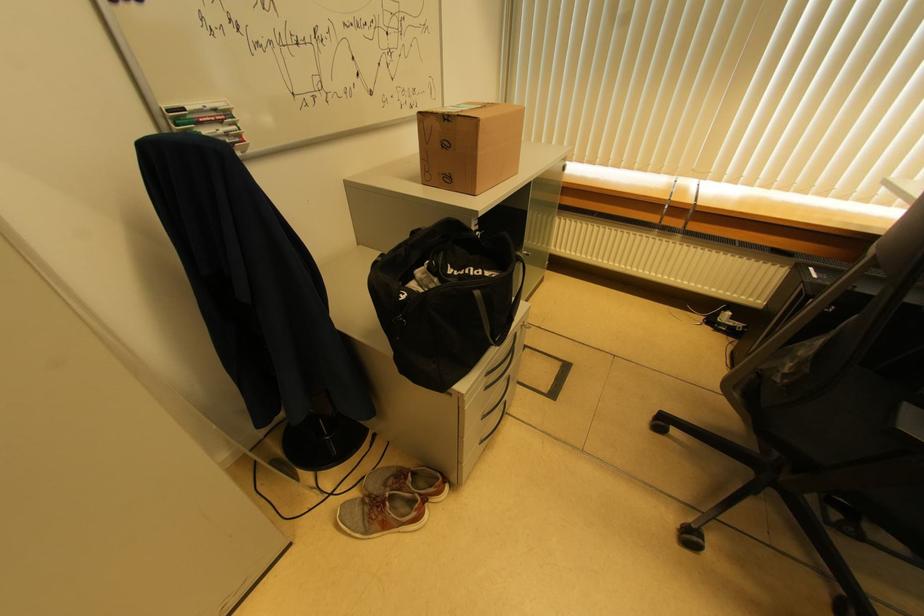
Locate an element on the screen. This screenshot has width=924, height=616. black bag strap is located at coordinates (500, 307).